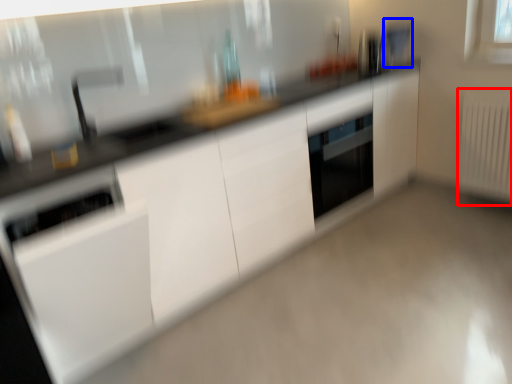
Question: Which object appears farthest to the camera in this image, radiator (highlighted by a red box) or appliance (highlighted by a blue box)?

Choices:
 (A) radiator
 (B) appliance

Answer: (B)